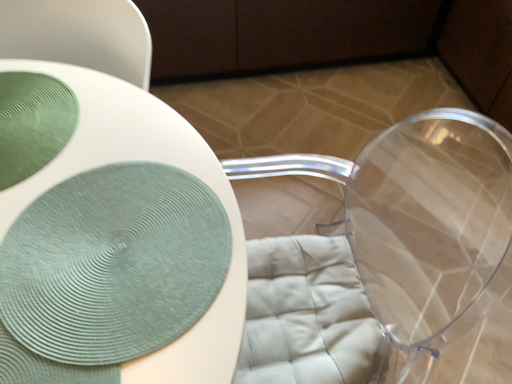
The height and width of the screenshot is (384, 512). I want to click on blank space above green textured placemat at center (from a real-world perspective), so click(x=79, y=186).